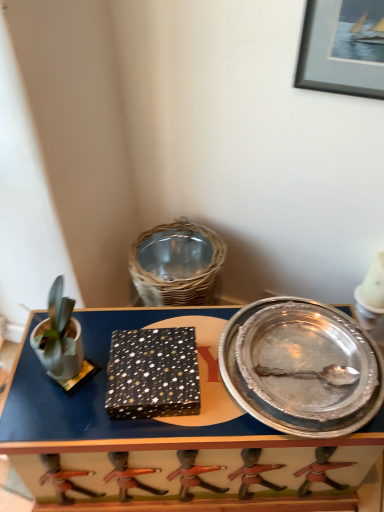
Describe the element at coordinates (300, 367) in the screenshot. I see `silver/metallic platter at right` at that location.

This screenshot has height=512, width=384. Describe the element at coordinates (169, 437) in the screenshot. I see `metallic silver tray at center` at that location.

The image size is (384, 512). Identify the location of metallic silver tray at center. (x=169, y=437).

Where is `black matte picture frame at upper right`? This screenshot has height=512, width=384. black matte picture frame at upper right is located at coordinates (343, 47).

Locate an element on the screen. silver/metallic platter at right is located at coordinates (300, 367).

Is metallic silver tray at center oriented away from black matte picture frame at upper right?

No, black matte picture frame at upper right is not at the back of metallic silver tray at center.

From the image's perspective, which is above, metallic silver tray at center or black matte picture frame at upper right?

black matte picture frame at upper right, from the image's perspective.

From a real-world perspective, which object rests below the other?

metallic silver tray at center.

Is metallic silver tray at center smaller than black matte picture frame at upper right?

Actually, metallic silver tray at center might be larger than black matte picture frame at upper right.

Between point (298, 325) and point (310, 40), which one is positioned in front?

The point (310, 40) is in front.

Is silver/metallic platter at right bigger or smaller than black matte picture frame at upper right?

Considering their sizes, silver/metallic platter at right takes up more space than black matte picture frame at upper right.

Which is behind, silver/metallic platter at right or black matte picture frame at upper right?

Positioned behind is silver/metallic platter at right.

Considering their positions, is black matte picture frame at upper right located in front of or behind silver/metallic platter at right?

black matte picture frame at upper right is positioned closer to the viewer than silver/metallic platter at right.

Considering the points (338, 14) and (348, 418), which point is in front, point (338, 14) or point (348, 418)?

Point (348, 418)

Considering the sizes of objects black matte picture frame at upper right and silver/metallic platter at right in the image provided, who is taller, black matte picture frame at upper right or silver/metallic platter at right?

black matte picture frame at upper right is taller.

Does black matte picture frame at upper right have a greater width compared to silver/metallic platter at right?

No, black matte picture frame at upper right is not wider than silver/metallic platter at right.

From the picture: Does black matte picture frame at upper right have a lesser width compared to metallic silver tray at center?

Indeed, black matte picture frame at upper right has a lesser width compared to metallic silver tray at center.

Is black matte picture frame at upper right oriented towards metallic silver tray at center?

No, black matte picture frame at upper right is not oriented towards metallic silver tray at center.

From a real-world perspective, who is located lower, black matte picture frame at upper right or metallic silver tray at center?

From a 3D spatial view, metallic silver tray at center is below.

Based on the photo, measure the distance from black matte picture frame at upper right to metallic silver tray at center.

33.63 inches.

Which object is wider, metallic silver tray at center or silver/metallic platter at right?

With larger width is metallic silver tray at center.

Between point (26, 340) and point (309, 307), which one is positioned in front?

Point (26, 340)

Could you tell me if metallic silver tray at center is turned towards silver/metallic platter at right?

No.

Is silver/metallic platter at right to the right of metallic silver tray at center from the viewer's perspective?

Yes, silver/metallic platter at right is to the right of metallic silver tray at center.

Between silver/metallic platter at right and metallic silver tray at center, which one has larger size?

With larger size is metallic silver tray at center.

Which point is more forward, (233, 334) or (218, 374)?

The point (218, 374) is closer to the camera.

The height and width of the screenshot is (512, 384). Find the location of `table lying below the black matte picture frame at upper right (from the image's perspective)`. table lying below the black matte picture frame at upper right (from the image's perspective) is located at coordinates (169, 437).

You are a GUI agent. You are given a task and a screenshot of the screen. Output one action in this format:
    pyautogui.click(x=<x>, y=<y>)
    Task: Click on the platter below the black matte picture frame at upper right (from a real-world perspective)
    The image size is (384, 512).
    Given the screenshot: What is the action you would take?
    pyautogui.click(x=300, y=367)

When comparing their distances from silver/metallic platter at right, does black matte picture frame at upper right or metallic silver tray at center seem further?

Based on the image, black matte picture frame at upper right appears to be further to silver/metallic platter at right.

When comparing their distances from silver/metallic platter at right, does metallic silver tray at center or black matte picture frame at upper right seem closer?

metallic silver tray at center is closer to silver/metallic platter at right.

Consider the image. Estimate the real-world distances between objects in this image. Which object is closer to metallic silver tray at center, silver/metallic platter at right or black matte picture frame at upper right?

silver/metallic platter at right is closer to metallic silver tray at center.

Looking at the image, which one is located further to black matte picture frame at upper right, silver/metallic platter at right or metallic silver tray at center?

The object further to black matte picture frame at upper right is metallic silver tray at center.

In the scene shown: Looking at the image, which one is located further to metallic silver tray at center, black matte picture frame at upper right or silver/metallic platter at right?

black matte picture frame at upper right lies further to metallic silver tray at center than the other object.

Which object lies further to the anchor point black matte picture frame at upper right, metallic silver tray at center or silver/metallic platter at right?

metallic silver tray at center is further to black matte picture frame at upper right.

Find the location of a particular element. The width and height of the screenshot is (384, 512). platter between black matte picture frame at upper right and metallic silver tray at center from top to bottom is located at coordinates (300, 367).